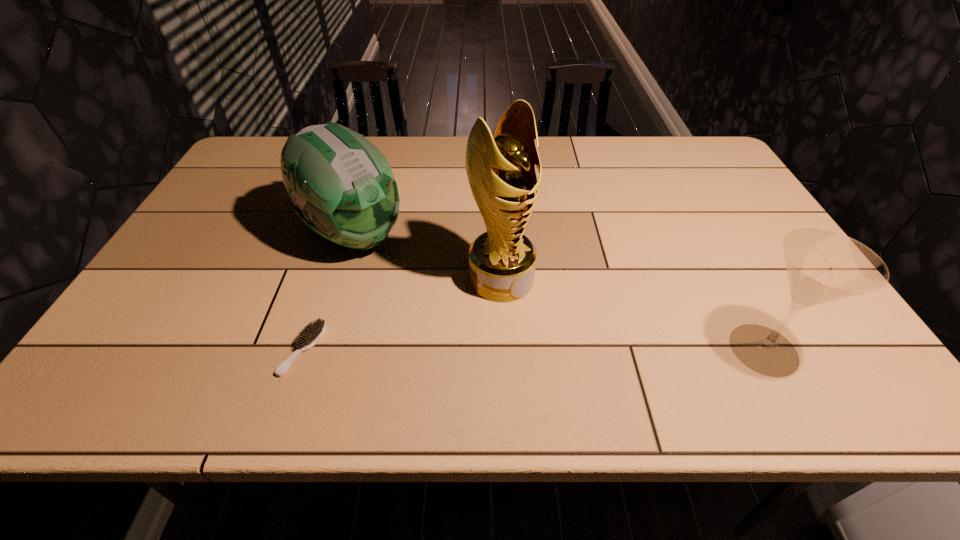
Where is `free spot on the desktop that is between the scrubbing brush and the flute glass and is positioned on the visor of the football helmet`? The image size is (960, 540). free spot on the desktop that is between the scrubbing brush and the flute glass and is positioned on the visor of the football helmet is located at coordinates (496, 349).

Where is `vacant space on the desktop that is between the shortest object and the rightmost object and is positioned on the front-facing side of the tallest object`? The width and height of the screenshot is (960, 540). vacant space on the desktop that is between the shortest object and the rightmost object and is positioned on the front-facing side of the tallest object is located at coordinates (592, 349).